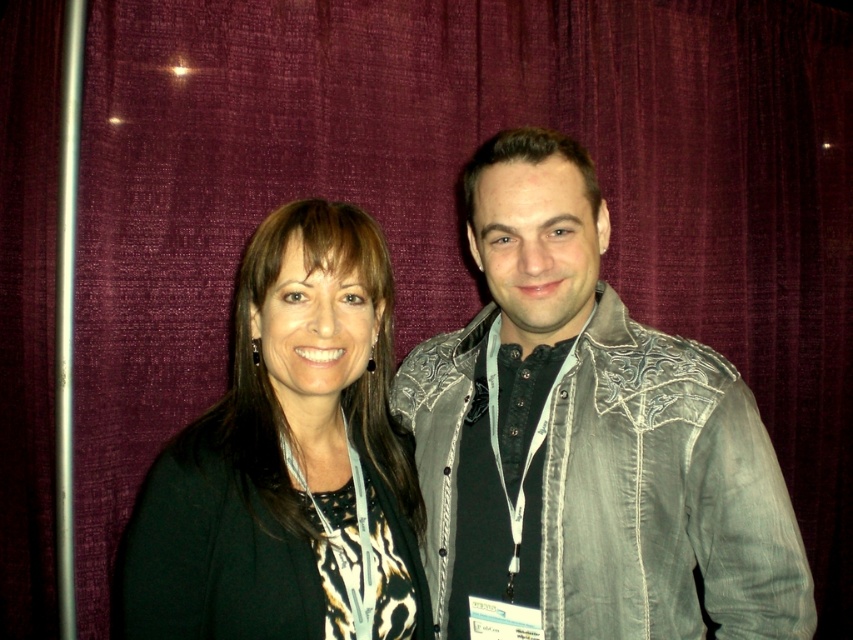
Question: Among these objects, which one is nearest to the camera?

Choices:
 (A) denim jacket at center
 (B) black matte jacket at center

Answer: (B)

Question: Among these objects, which one is farthest from the camera?

Choices:
 (A) black matte jacket at center
 (B) denim jacket at center

Answer: (B)

Question: Observing the image, what is the correct spatial positioning of denim jacket at center in reference to black matte jacket at center?

Choices:
 (A) right
 (B) left

Answer: (A)

Question: Considering the relative positions of denim jacket at center and black matte jacket at center in the image provided, where is denim jacket at center located with respect to black matte jacket at center?

Choices:
 (A) left
 (B) right

Answer: (B)

Question: Which of the following is the farthest from the observer?

Choices:
 (A) black matte jacket at center
 (B) denim jacket at center

Answer: (B)

Question: Does denim jacket at center have a larger size compared to black matte jacket at center?

Choices:
 (A) no
 (B) yes

Answer: (B)